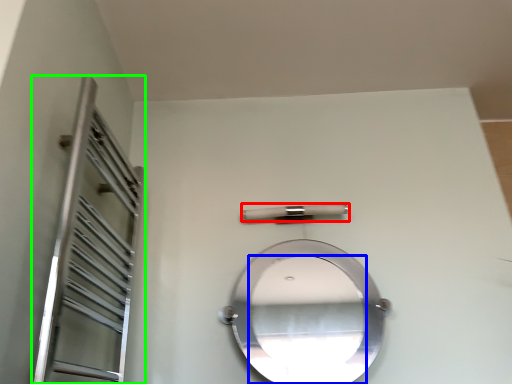
Question: Which is nearer to the door handle (highlighted by a red box)? mirror (highlighted by a blue box) or screen door (highlighted by a green box).

Choices:
 (A) mirror
 (B) screen door

Answer: (B)